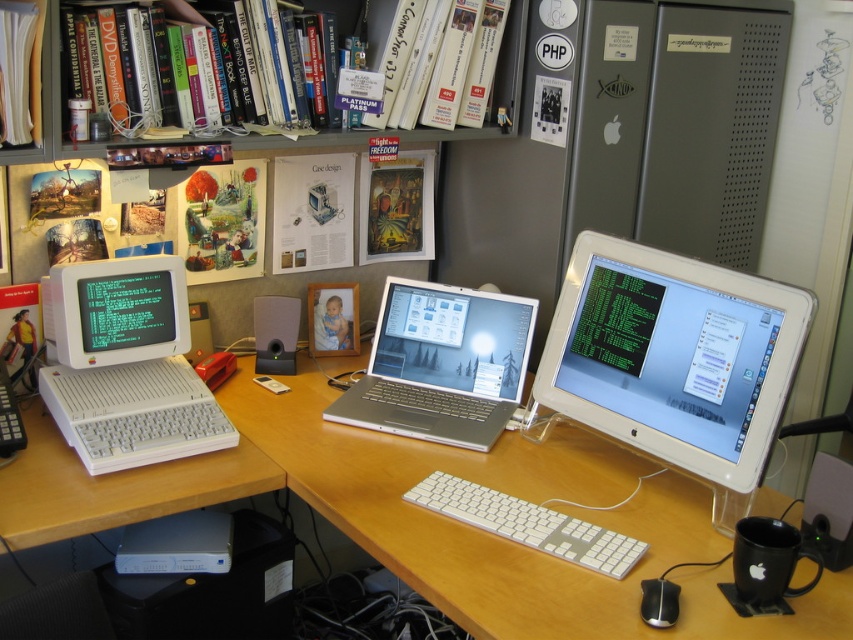
You are organizing cables for the workspace shown. You need to connect a new USB hub to the device with the smaller width between the white glossy monitor at center right and the silver metallic laptop at center. Which device should you connect it to?

The white glossy monitor at center right has a lesser width compared to the silver metallic laptop at center, so you should connect the USB hub to the white glossy monitor at center right.

You are organizing a tech exhibition and need to place a label next to both the white plastic keyboard at center and the black plastic mouse at lower right. Since space is limited, you want to know which one is taller to position the label accordingly. Which object is taller?

The white plastic keyboard at center is taller than the black plastic mouse at lower right, so the label should be placed next to the white plastic keyboard at center to account for its height.

You are an office worker who needs to place a new document organizer on the desk. The organizer is 10 cm tall. You want to place it on the wooden at center without blocking the silver metallic laptop at center. Is this possible?

The wooden at center is below the silver metallic laptop at center, so placing the document organizer on the wooden at center would not block the laptop since the laptop is elevated above it.